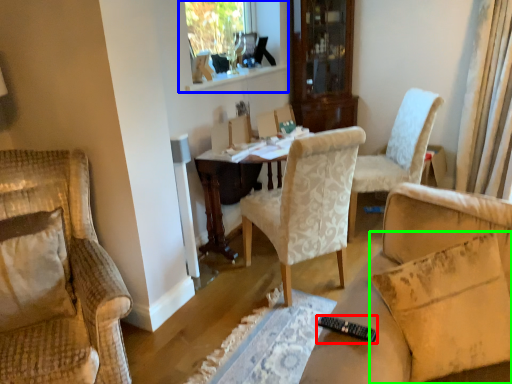
Question: Which object is the closest to the remote control (highlighted by a red box)? Choose among these: window frame (highlighted by a blue box) or pillow (highlighted by a green box).

Choices:
 (A) window frame
 (B) pillow

Answer: (B)